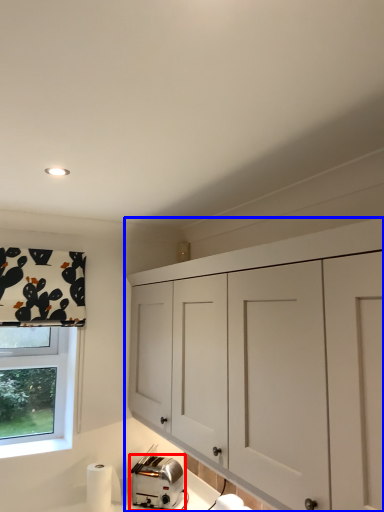
Question: Among these objects, which one is nearest to the camera, toaster (highlighted by a red box) or cabinetry (highlighted by a blue box)?

Choices:
 (A) toaster
 (B) cabinetry

Answer: (B)